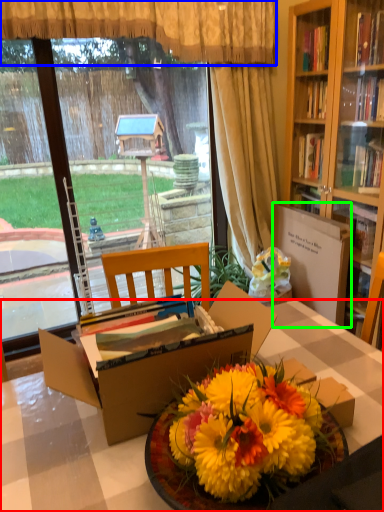
Question: Considering the real-world distances, which object is closest to desk (highlighted by a red box)? curtain (highlighted by a blue box) or cardboard box (highlighted by a green box).

Choices:
 (A) curtain
 (B) cardboard box

Answer: (B)